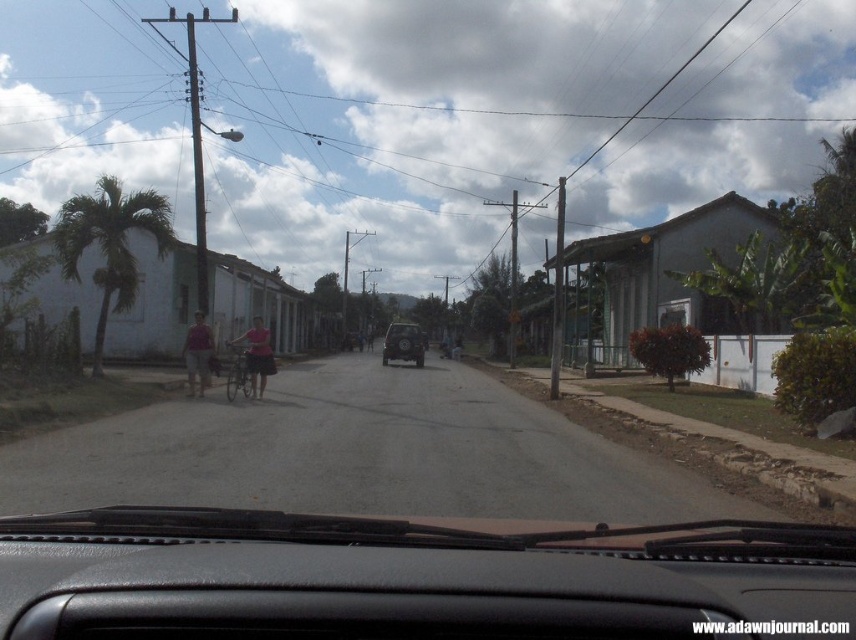
Is pink fabric shirt at center positioned at the back of matte pink shirt at center?

No, pink fabric shirt at center is closer to the viewer.

Who is taller, pink fabric shirt at center or matte pink shirt at center?

Standing taller between the two is pink fabric shirt at center.

This screenshot has height=640, width=856. In order to click on pink fabric shirt at center in this screenshot , I will do `click(254, 356)`.

Identify the location of pink fabric shirt at center. (254, 356).

Can you confirm if green leafy palm tree at left is positioned above matte pink shirt at center?

Yes, green leafy palm tree at left is above matte pink shirt at center.

The image size is (856, 640). Find the location of `green leafy palm tree at left`. green leafy palm tree at left is located at coordinates (110, 243).

Does green leafy palm tree at left appear on the right side of pink fabric shirt at center?

Incorrect, green leafy palm tree at left is not on the right side of pink fabric shirt at center.

Between green leafy palm tree at left and pink fabric shirt at center, which one is positioned higher?

green leafy palm tree at left is higher up.

Between point (116, 308) and point (253, 380), which one is positioned in front?

Point (253, 380)

Locate an element on the screen. green leafy palm tree at left is located at coordinates point(110,243).